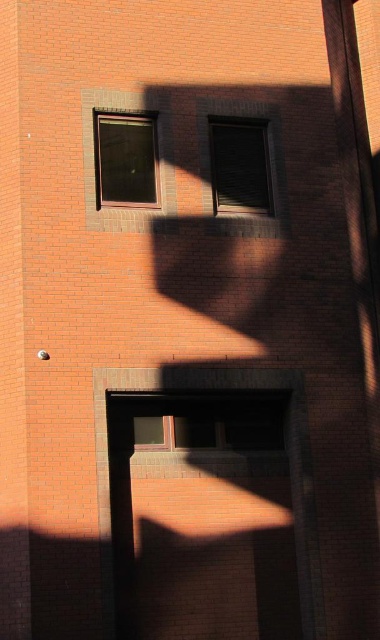
Question: Which of the following is the closest to the observer?

Choices:
 (A) (210, 144)
 (B) (98, 138)

Answer: (B)

Question: Which point is closer to the camera taking this photo?

Choices:
 (A) (215, 148)
 (B) (118, 177)

Answer: (B)

Question: In this image, where is matte glass window at upper center located relative to matte glass window at center?

Choices:
 (A) right
 (B) left

Answer: (B)

Question: Which point appears farthest from the camera in this image?

Choices:
 (A) (126, 140)
 (B) (213, 120)

Answer: (B)

Question: Is matte glass window at upper center closer to the viewer compared to matte glass window at center?

Choices:
 (A) yes
 (B) no

Answer: (A)

Question: Does matte glass window at upper center have a smaller size compared to matte glass window at center?

Choices:
 (A) yes
 (B) no

Answer: (A)